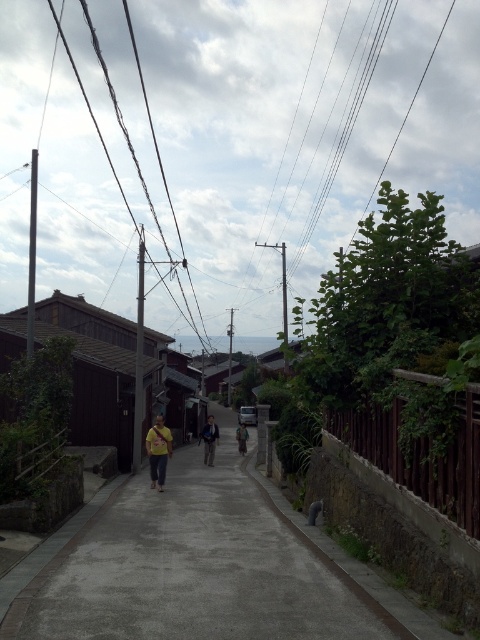
Question: Does black wire at upper center have a lesser width compared to yellow fabric shirt at center?

Choices:
 (A) no
 (B) yes

Answer: (A)

Question: Which object is closer to the camera taking this photo?

Choices:
 (A) yellow fabric bag at center
 (B) yellow fabric at center

Answer: (A)

Question: Which point is farther from the camera taking this photo?

Choices:
 (A) (206, 433)
 (B) (276, 602)

Answer: (A)

Question: Based on their relative distances, which object is nearer to the yellow fabric at center?

Choices:
 (A) yellow fabric shirt at center
 (B) gray concrete pavement at center

Answer: (A)

Question: Can you confirm if black wire at upper center is bigger than yellow fabric at center?

Choices:
 (A) no
 (B) yes

Answer: (B)

Question: Is gray concrete pavement at center to the right of yellow fabric bag at center from the viewer's perspective?

Choices:
 (A) no
 (B) yes

Answer: (B)